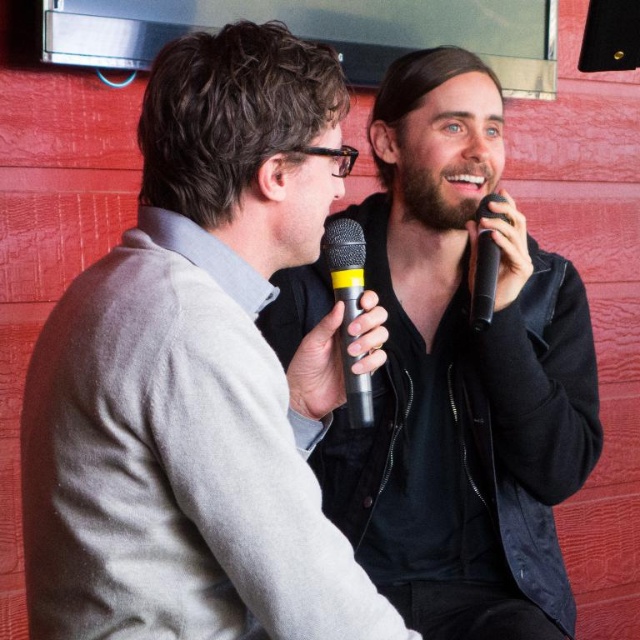
You are a photographer setting up for a photo shoot and need to ensure proper lighting. Based on the scene description, which object, the matte black jacket at center or the black rubber microphone at center, should you adjust the lighting for first to avoid shadows?

The matte black jacket at center is located below the black rubber microphone at center, so you should adjust the lighting for the matte black jacket at center first to avoid its shadow obscuring the microphone above it.

You are an artist trying to sketch this scene. To ensure accuracy, you need to know the exact position of the gray wool sweater at left. Can you determine its location based on the scene description?

The gray wool sweater at left is located at the 2D coordinates point (198, 376).

You are a photographer planning to take a portrait of the two people in the scene. You want to ensure that both the gray wool sweater at left and the black matte microphone at right are clearly visible in the frame. Given their height difference, which object should you position closer to the camera to maintain balance in the composition?

The gray wool sweater at left is much taller than the black matte microphone at right. To balance the composition, you should position the black matte microphone at right closer to the camera so that its apparent size matches the height of the taller gray wool sweater at left.